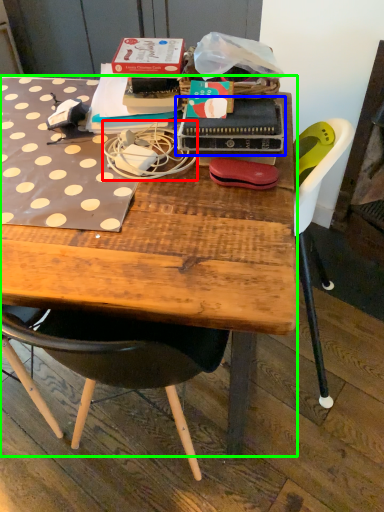
Question: Which object is positioned farthest from string (highlighted by a red box)? Select from paperback book (highlighted by a blue box) and desk (highlighted by a green box).

Choices:
 (A) paperback book
 (B) desk

Answer: (B)